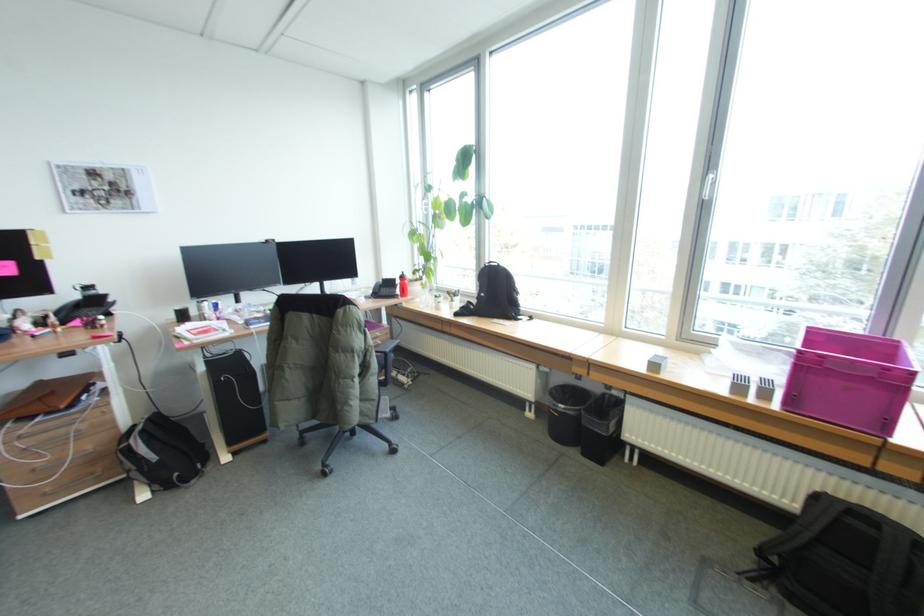
Where would you lift the black telephone handset? Please return your answer as a coordinate pair (x, y).

(383, 288)